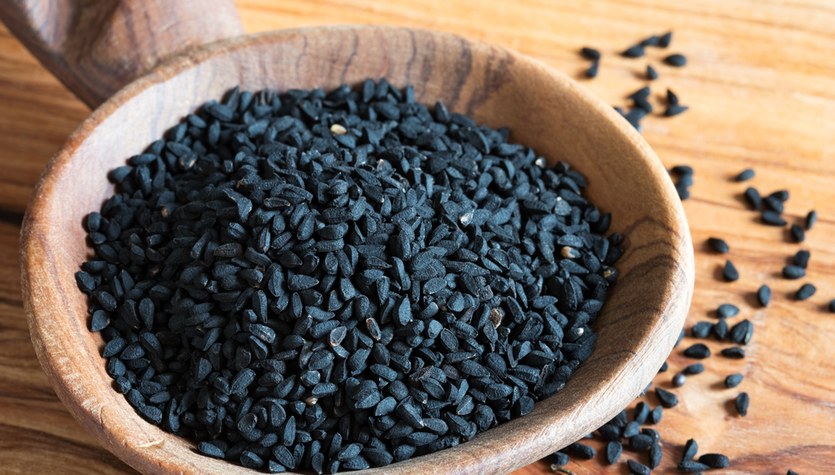
Where is `handle`? This screenshot has height=475, width=835. handle is located at coordinates (153, 29).